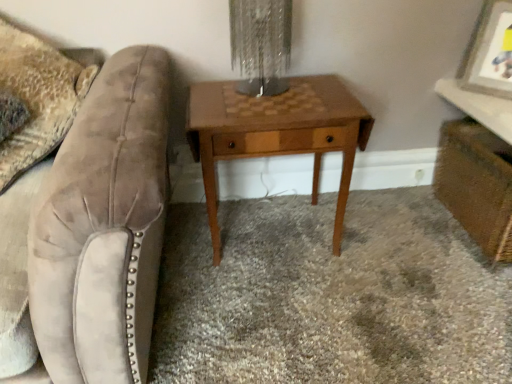
Question: From the image's perspective, is velvet swivel chair at left over wooden vanity at lower right?

Choices:
 (A) yes
 (B) no

Answer: (B)

Question: Considering the relative positions of velvet swivel chair at left and wooden vanity at lower right in the image provided, is velvet swivel chair at left to the right of wooden vanity at lower right from the viewer's perspective?

Choices:
 (A) yes
 (B) no

Answer: (B)

Question: Does velvet swivel chair at left come behind wooden vanity at lower right?

Choices:
 (A) yes
 (B) no

Answer: (B)

Question: From a real-world perspective, is velvet swivel chair at left beneath wooden vanity at lower right?

Choices:
 (A) no
 (B) yes

Answer: (A)

Question: Can you confirm if velvet swivel chair at left is smaller than wooden vanity at lower right?

Choices:
 (A) yes
 (B) no

Answer: (B)

Question: Are velvet swivel chair at left and wooden vanity at lower right far apart?

Choices:
 (A) yes
 (B) no

Answer: (A)

Question: Is brown wood table at center outside wooden vanity at lower right?

Choices:
 (A) yes
 (B) no

Answer: (A)

Question: Is brown wood table at center further to camera compared to wooden vanity at lower right?

Choices:
 (A) no
 (B) yes

Answer: (A)

Question: Does brown wood table at center have a larger size compared to wooden vanity at lower right?

Choices:
 (A) no
 (B) yes

Answer: (B)

Question: Is there a large distance between brown wood table at center and wooden vanity at lower right?

Choices:
 (A) no
 (B) yes

Answer: (A)

Question: Is brown wood table at center at the left side of wooden vanity at lower right?

Choices:
 (A) yes
 (B) no

Answer: (A)

Question: Is wooden vanity at lower right located within brown wood table at center?

Choices:
 (A) yes
 (B) no

Answer: (B)

Question: From the image's perspective, is wooden picture frame at upper right located beneath velvet swivel chair at left?

Choices:
 (A) yes
 (B) no

Answer: (B)